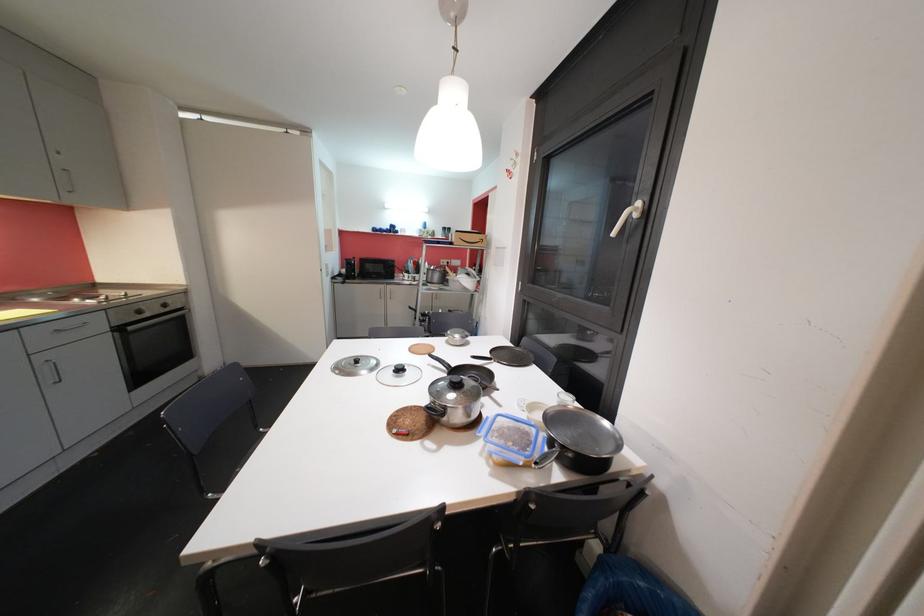
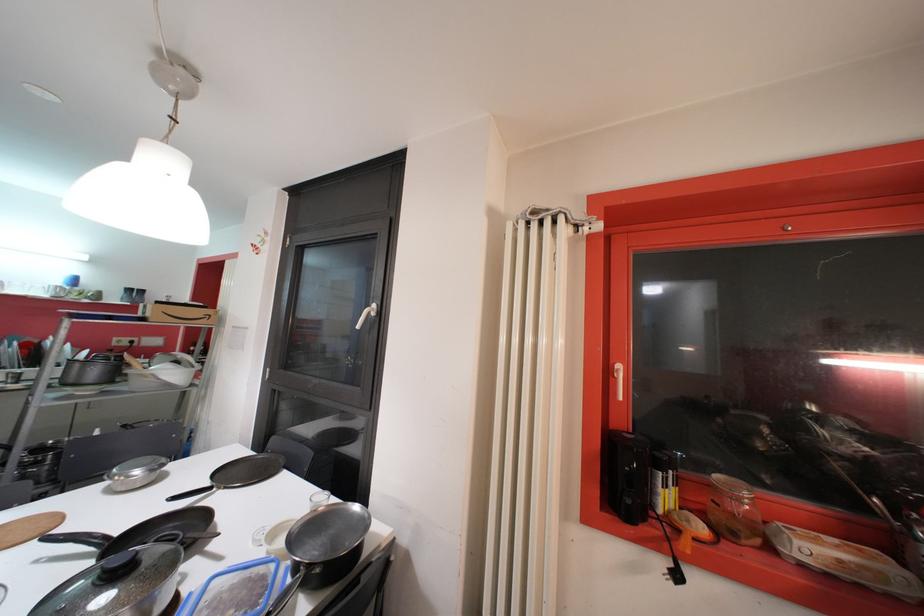
Locate, in the second image, the point that corresponds to (493,358) in the first image.

(213, 485)